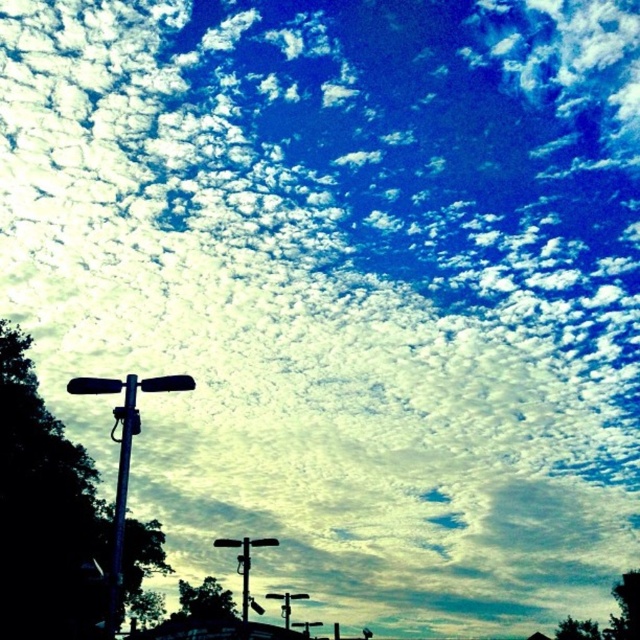
Does metallic pole at left appear on the right side of metallic pole at center?

No, metallic pole at left is not to the right of metallic pole at center.

Does point (113, 426) come farther from viewer compared to point (237, 541)?

No, (113, 426) is closer to viewer.

Find the location of a particular element. The height and width of the screenshot is (640, 640). metallic pole at left is located at coordinates (124, 461).

Can you confirm if metallic blue pole at left is thinner than metallic pole at center?

Yes, metallic blue pole at left is thinner than metallic pole at center.

Between metallic blue pole at left and metallic pole at center, which one appears on the left side from the viewer's perspective?

metallic blue pole at left is more to the left.

Which is behind, point (124, 458) or point (241, 557)?

The point (241, 557) is more distant.

The image size is (640, 640). What are the coordinates of `metallic blue pole at left` in the screenshot? It's located at (120, 500).

Is the position of metallic pole at left less distant than that of metallic blue pole at left?

That is False.

Is point (92, 388) positioned after point (122, 458)?

Yes, it is.

The height and width of the screenshot is (640, 640). What are the coordinates of `metallic pole at left` in the screenshot? It's located at (124, 461).